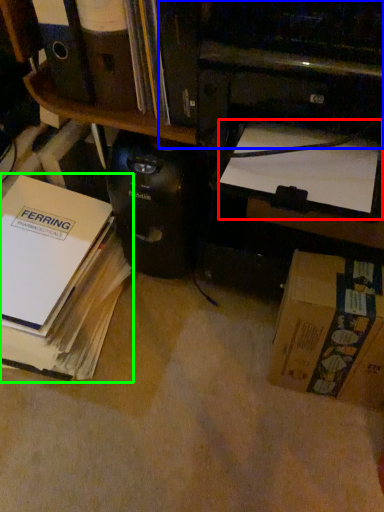
Question: Considering the real-world distances, which object is farthest from book (highlighted by a red box)? printer (highlighted by a blue box) or book (highlighted by a green box)?

Choices:
 (A) printer
 (B) book

Answer: (B)